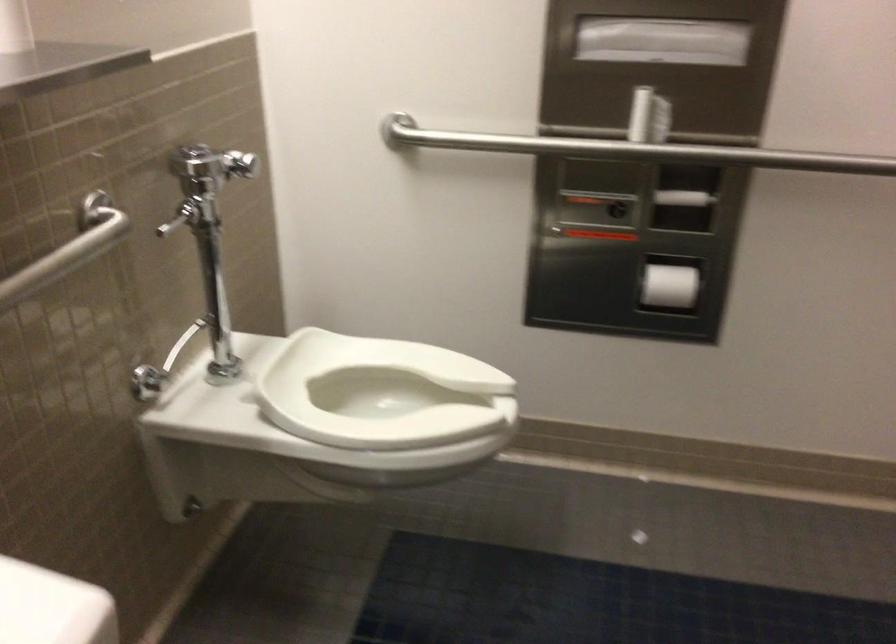
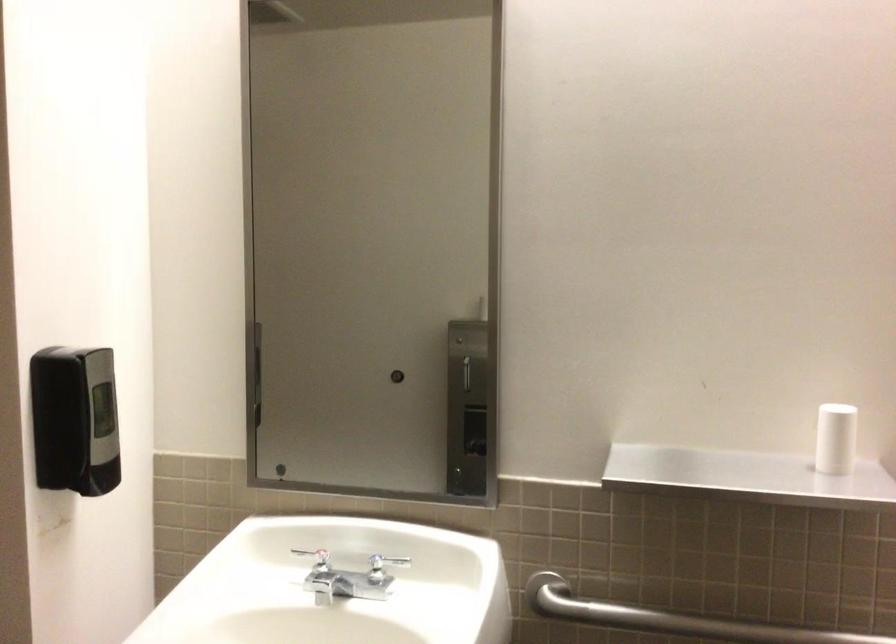
Question: The first image is from the beginning of the video and the second image is from the end. How did the camera likely rotate when shooting the video?

Choices:
 (A) Left
 (B) Right
 (C) Up
 (D) Down

Answer: (A)